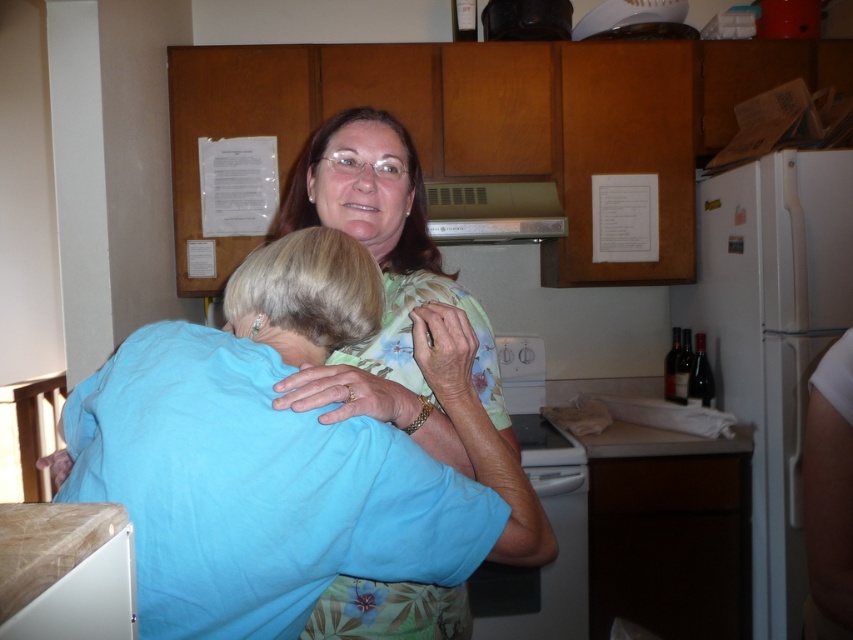
Question: Which of the following is the closest to the observer?

Choices:
 (A) light blue fabric shirt at center
 (B) white glossy dishwasher at center
 (C) floral print blouse at center

Answer: (A)

Question: Is floral print blouse at center in front of white glossy dishwasher at center?

Choices:
 (A) no
 (B) yes

Answer: (B)

Question: Does floral print blouse at center have a smaller size compared to white glossy dishwasher at center?

Choices:
 (A) yes
 (B) no

Answer: (B)

Question: Can you confirm if light blue fabric shirt at center is positioned to the right of white glossy dishwasher at center?

Choices:
 (A) yes
 (B) no

Answer: (B)

Question: Which object is closer to the camera taking this photo?

Choices:
 (A) white glossy dishwasher at center
 (B) floral print blouse at center
 (C) light blue fabric shirt at center

Answer: (C)

Question: Among these points, which one is nearest to the camera?

Choices:
 (A) (213, 342)
 (B) (469, 588)
 (C) (399, 412)

Answer: (A)